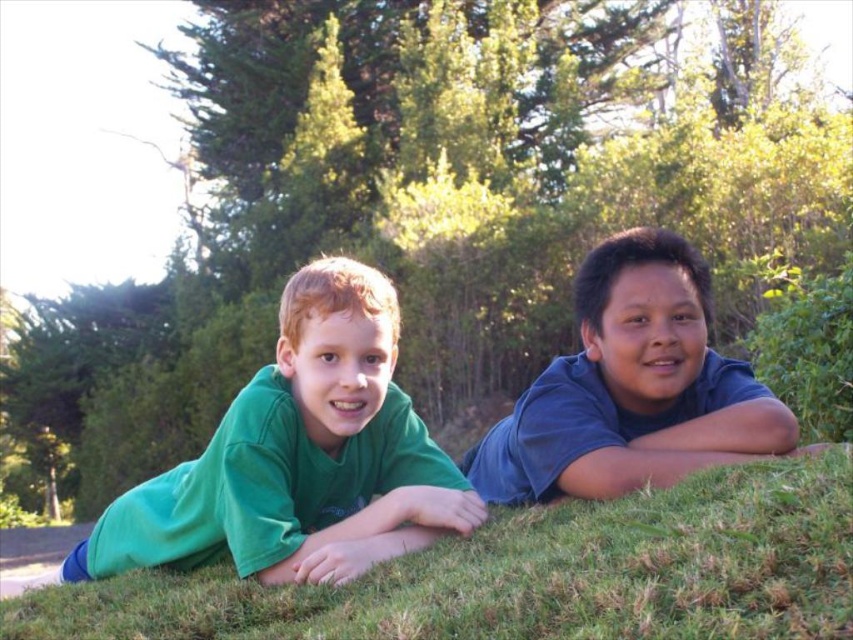
Question: Which of the following is the closest to the observer?

Choices:
 (A) blue cotton shirt at center
 (B) green matte shirt at left
 (C) green grass at lower center

Answer: (C)

Question: Does green grass at lower center have a lesser width compared to blue cotton shirt at center?

Choices:
 (A) yes
 (B) no

Answer: (B)

Question: Is green grass at lower center above blue cotton shirt at center?

Choices:
 (A) yes
 (B) no

Answer: (B)

Question: Does green grass at lower center have a larger size compared to blue cotton shirt at center?

Choices:
 (A) yes
 (B) no

Answer: (A)

Question: Which point is closer to the camera?

Choices:
 (A) (390, 353)
 (B) (735, 472)

Answer: (B)

Question: Which object is farther from the camera taking this photo?

Choices:
 (A) green matte shirt at left
 (B) blue cotton shirt at center
 (C) green grass at lower center

Answer: (B)